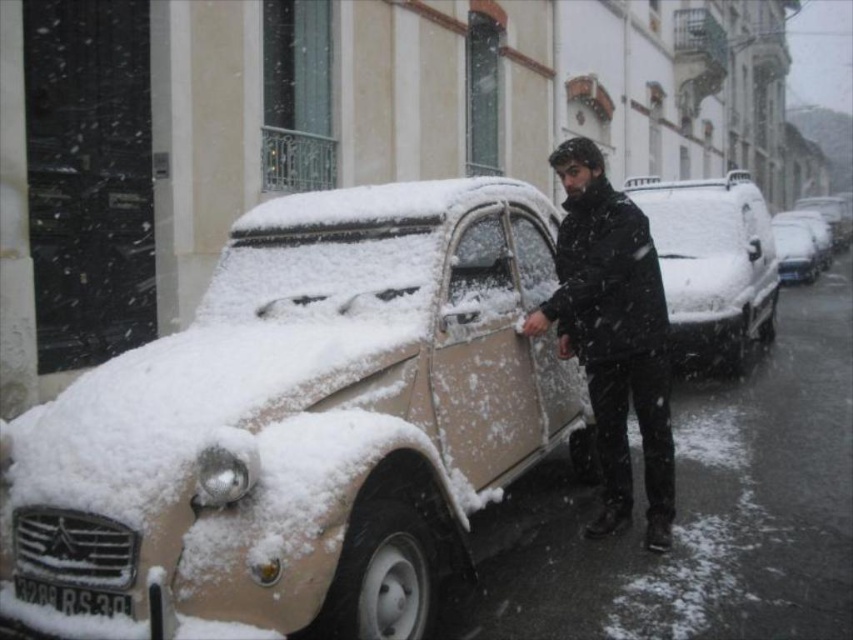
Does point (540, 404) come farther from viewer compared to point (691, 182)?

No, it is in front of (691, 182).

At what (x,y) coordinates should I click in order to perform the action: click on beige matte car at center. Please return your answer as a coordinate pair (x, y). The width and height of the screenshot is (853, 640). Looking at the image, I should click on (305, 422).

Measure the distance between snow-covered beige car at center and white plastic license plate at lower center.

snow-covered beige car at center and white plastic license plate at lower center are 8.06 meters apart.

Can you confirm if snow-covered beige car at center is positioned to the left of white plastic license plate at lower center?

No, snow-covered beige car at center is not to the left of white plastic license plate at lower center.

Is point (688, 352) more distant than point (79, 588)?

Yes, point (688, 352) is behind point (79, 588).

The image size is (853, 640). I want to click on snow-covered beige car at center, so click(x=712, y=266).

Does black matte jacket at center come in front of snow-covered beige car at center?

Yes, black matte jacket at center is closer to the viewer.

Between point (570, 348) and point (669, 288), which one is positioned in front?

Positioned in front is point (570, 348).

Image resolution: width=853 pixels, height=640 pixels. What are the coordinates of `black matte jacket at center` in the screenshot? It's located at coord(613,333).